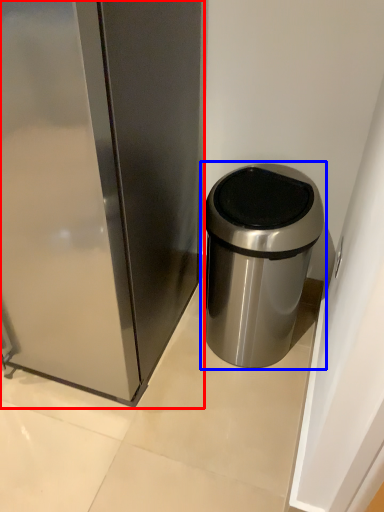
Question: Which object is closer to the camera taking this photo, appliance (highlighted by a red box) or waste container (highlighted by a blue box)?

Choices:
 (A) appliance
 (B) waste container

Answer: (A)